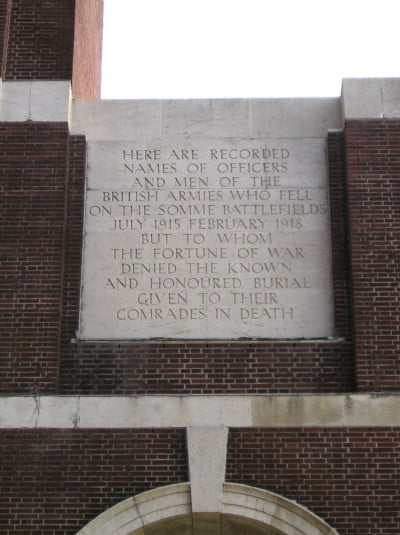
Find the location of a particular element. This screenshot has width=400, height=535. columns is located at coordinates (29, 225), (384, 301).